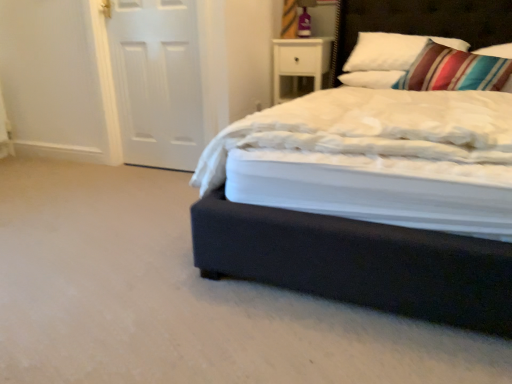
Question: Is point (322, 71) positioned closer to the camera than point (476, 1)?

Choices:
 (A) farther
 (B) closer

Answer: (A)

Question: Considering the positions of white glossy nightstand at upper right and dark wood headboard at upper right in the image, is white glossy nightstand at upper right bigger or smaller than dark wood headboard at upper right?

Choices:
 (A) big
 (B) small

Answer: (B)

Question: Which object is the farthest from the dark wood headboard at upper right?

Choices:
 (A) white matte door at left
 (B) white soft pillow at upper right, the first pillow positioned from the left
 (C) dark blue fabric bed at center
 (D) striped fabric pillow at upper right, which appears as the 1th pillow when viewed from the right
 (E) white glossy nightstand at upper right

Answer: (C)

Question: Which object is positioned farthest from the white matte door at left?

Choices:
 (A) dark wood headboard at upper right
 (B) white soft pillow at upper right, the first pillow positioned from the left
 (C) white glossy nightstand at upper right
 (D) striped fabric pillow at upper right, which ranks as the second pillow in left-to-right order
 (E) dark blue fabric bed at center

Answer: (D)